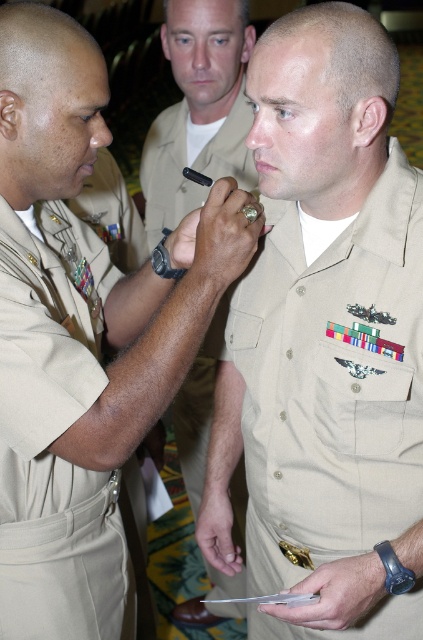
You are a photographer trying to capture a closeup of the medal being pinned. You can focus on either the point at point (65,266) or point (189,195). Which point should you focus on to get the medal in focus?

You should focus on point (65,266) because it is closer to the camera and thus more likely to be in focus when capturing the medal being pinned.